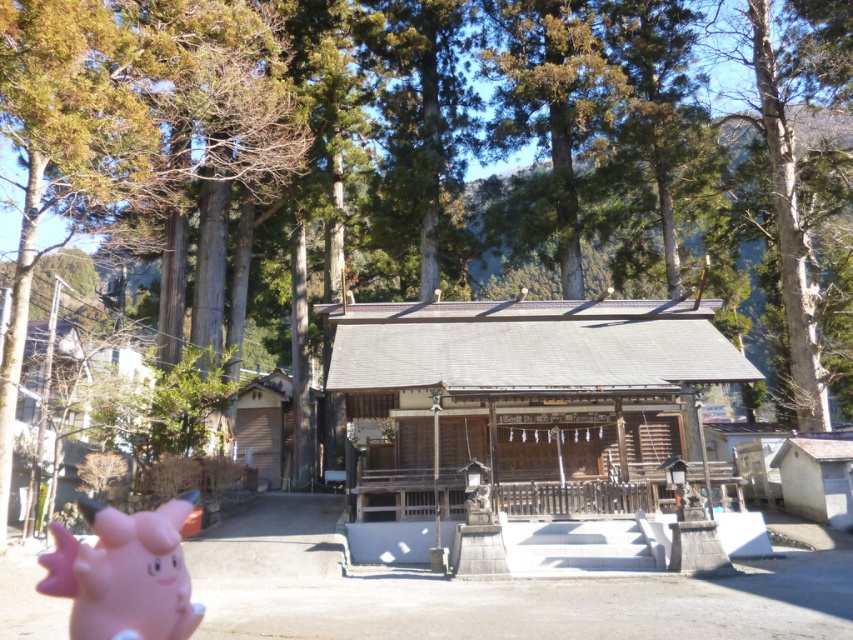
Which is more to the right, pink rubber piggy at lower left or wooden gate at left?

pink rubber piggy at lower left is more to the right.

Consider the image. Does pink rubber piggy at lower left have a larger size compared to wooden gate at left?

Actually, pink rubber piggy at lower left might be smaller than wooden gate at left.

Which is behind, point (97, 634) or point (247, 464)?

The point (247, 464) is behind.

This screenshot has width=853, height=640. Identify the location of pink rubber piggy at lower left. (125, 573).

Does wooden hut at center appear on the left side of wooden gate at left?

No, wooden hut at center is not to the left of wooden gate at left.

Describe the element at coordinates (526, 396) in the screenshot. I see `wooden hut at center` at that location.

Where is `wooden hut at center`? wooden hut at center is located at coordinates (526, 396).

Is white wood hut at lower right to the right of wooden gate at left from the viewer's perspective?

Indeed, white wood hut at lower right is positioned on the right side of wooden gate at left.

Between point (843, 488) and point (276, 444), which one is positioned behind?

Positioned behind is point (276, 444).

This screenshot has width=853, height=640. Identify the location of white wood hut at lower right. (816, 477).